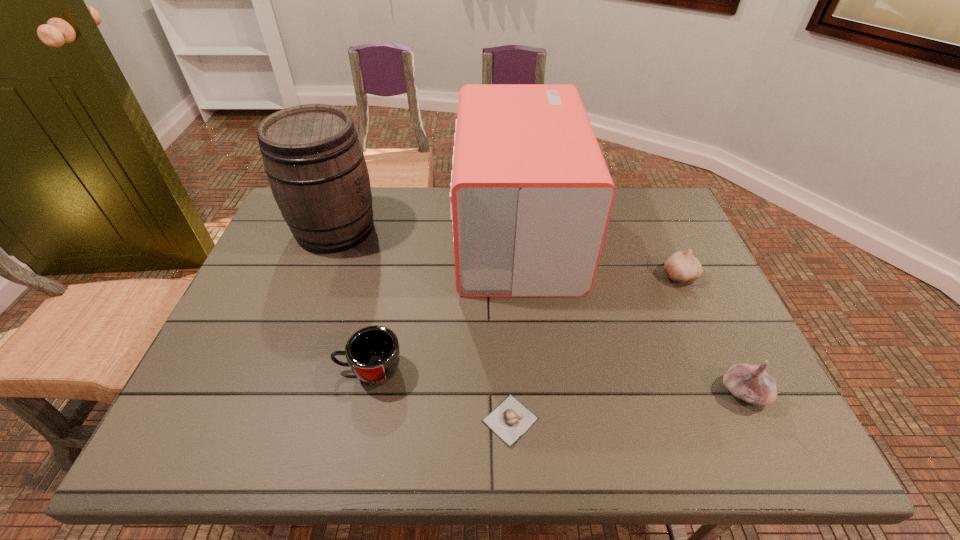
Find the location of a particular element. box is located at coordinates (531, 196).

The width and height of the screenshot is (960, 540). What are the coordinates of `wine bucket` in the screenshot? It's located at (315, 164).

The width and height of the screenshot is (960, 540). Identify the location of the tallest garlic. (751, 383).

Locate an element on the screen. This screenshot has width=960, height=540. the farthest garlic is located at coordinates (681, 266).

The width and height of the screenshot is (960, 540). Find the location of `mug`. mug is located at coordinates (373, 353).

Image resolution: width=960 pixels, height=540 pixels. I want to click on the shortest garlic, so click(x=510, y=420).

Locate an element on the screen. The image size is (960, 540). the leftmost garlic is located at coordinates (510, 420).

Where is `free space located on the surface of the box where the text is embossed`? This screenshot has height=540, width=960. free space located on the surface of the box where the text is embossed is located at coordinates (377, 234).

This screenshot has width=960, height=540. In order to click on vacant space located on the surface of the box where the text is embossed in this screenshot , I will do `click(437, 234)`.

Locate an element on the screen. Image resolution: width=960 pixels, height=540 pixels. free region located 0.080m on the surface of the box where the text is embossed is located at coordinates (430, 234).